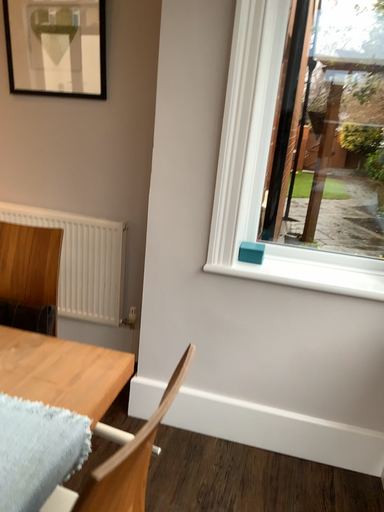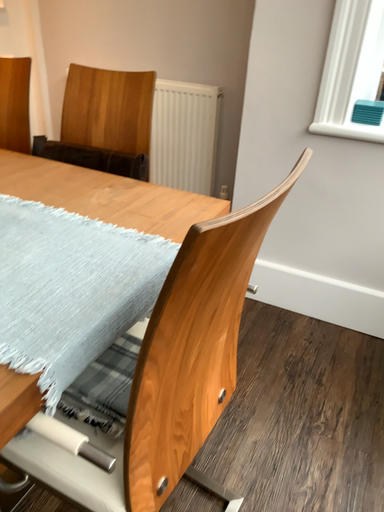
Question: How did the camera likely rotate when shooting the video?

Choices:
 (A) rotated right
 (B) rotated left

Answer: (B)